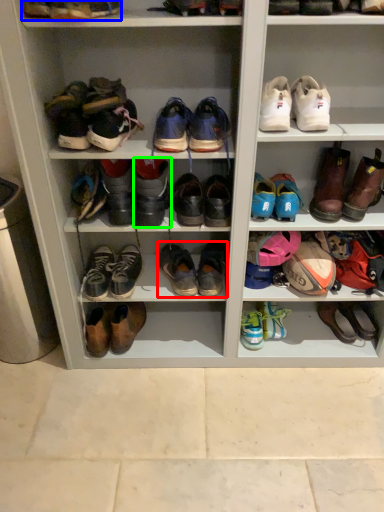
Question: Based on their relative distances, which object is farther from footwear (highlighted by a red box)? Choose from footwear (highlighted by a blue box) and footwear (highlighted by a green box).

Choices:
 (A) footwear
 (B) footwear

Answer: (A)